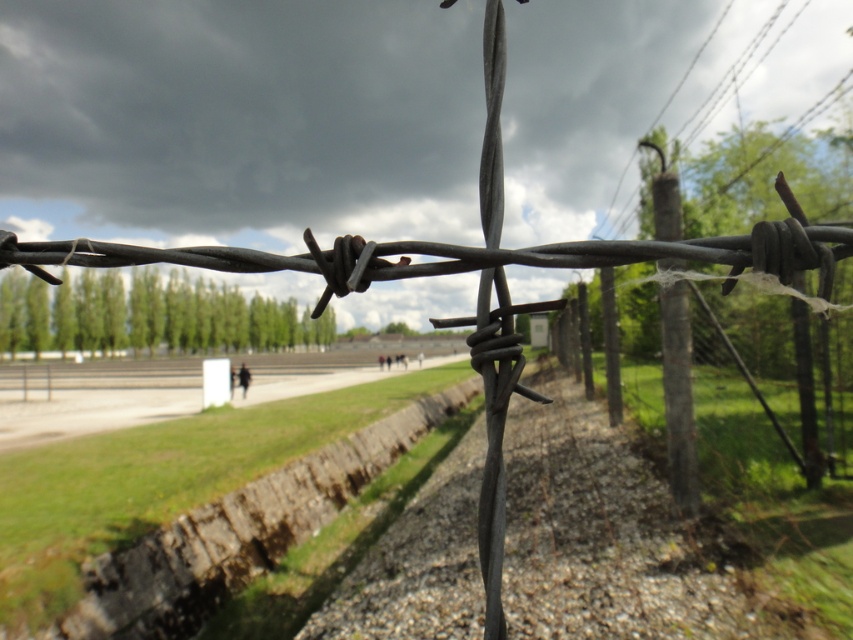
Who is positioned more to the left, rusty concrete trench at center or rusty wire fence at center?

From the viewer's perspective, rusty concrete trench at center appears more on the left side.

Does rusty concrete trench at center have a larger size compared to rusty wire fence at center?

Incorrect, rusty concrete trench at center is not larger than rusty wire fence at center.

Is point (281, 467) closer to viewer compared to point (753, 225)?

No, it is behind (753, 225).

Locate an element on the screen. rusty concrete trench at center is located at coordinates (241, 531).